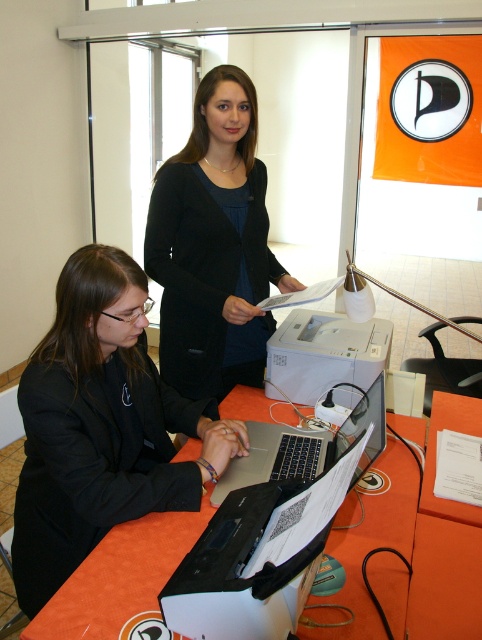
You are a person who is 1.8 meters tall. You are standing in front of the orange fabric table at lower center and the black matte blazer at upper center. Which object is closer to your eyes?

The black matte blazer at upper center is closer to your eyes because it is taller than the orange fabric table at lower center.

You are an office worker who needs to access the silver metallic laptop at center. However, there is a black matte blazer at upper center covering it. Can you reach the laptop without moving the blazer?

The black matte blazer at upper center is positioned over the silver metallic laptop at center, so you cannot reach the laptop without moving the blazer.